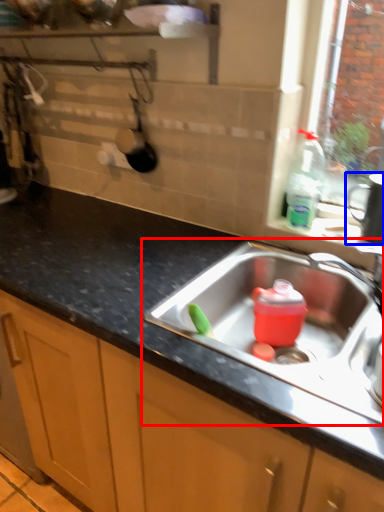
Question: Which object appears farthest to the camera in this image, sink (highlighted by a red box) or appliance (highlighted by a blue box)?

Choices:
 (A) sink
 (B) appliance

Answer: (B)